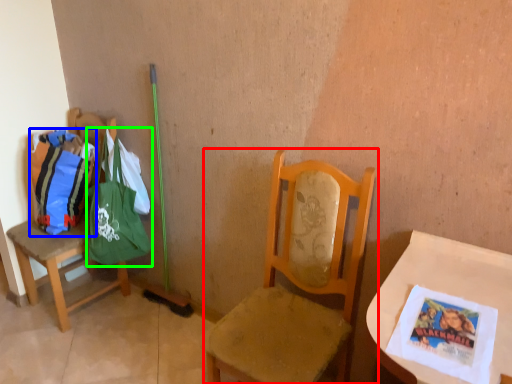
Question: Which object is positioned closest to chair (highlighted by a red box)? Select from grocery bag (highlighted by a blue box) and shoulder bag (highlighted by a green box).

Choices:
 (A) grocery bag
 (B) shoulder bag

Answer: (B)